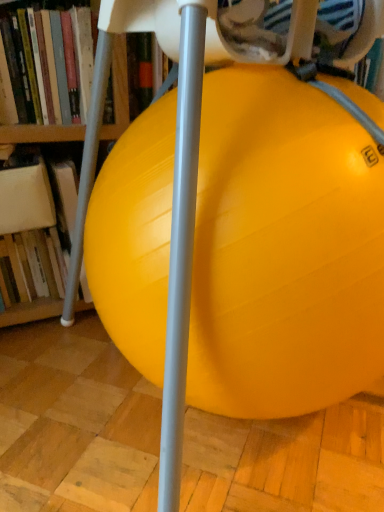
Describe the element at coordinates (26, 71) in the screenshot. I see `hardcover book at left, which is the first book from top to bottom` at that location.

I want to click on hardcover book at left, positioned as the 2th book in top-to-bottom order, so click(x=28, y=226).

Looking at their sizes, would you say yellow rubber ball at center is wider or thinner than hardcover book at left, positioned as the 2th book in top-to-bottom order?

In the image, yellow rubber ball at center appears to be wider than hardcover book at left, positioned as the 2th book in top-to-bottom order.

In terms of height, does yellow rubber ball at center look taller or shorter compared to hardcover book at left, positioned as the 1th book in bottom-to-top order?

In the image, yellow rubber ball at center appears to be taller than hardcover book at left, positioned as the 1th book in bottom-to-top order.

From a real-world perspective, who is located higher, yellow rubber ball at center or hardcover book at left, positioned as the 1th book in bottom-to-top order?

In real-world perspective, yellow rubber ball at center is above.

From the image's perspective, is yellow rubber ball at center located above or below hardcover book at left, which is the first book from top to bottom?

From the image's perspective, yellow rubber ball at center appears below hardcover book at left, which is the first book from top to bottom.

Who is shorter, yellow rubber ball at center or hardcover book at left, which is the first book from top to bottom?

hardcover book at left, which is the first book from top to bottom.

Which object is positioned more to the right, yellow rubber ball at center or hardcover book at left, which ranks as the 2th book in bottom-to-top order?

yellow rubber ball at center.

Is hardcover book at left, positioned as the 2th book in top-to-bottom order, facing away from yellow rubber ball at center?

No.

Is hardcover book at left, positioned as the 1th book in bottom-to-top order, outside of yellow rubber ball at center?

That's correct, hardcover book at left, positioned as the 1th book in bottom-to-top order, is outside of yellow rubber ball at center.

Which of these two, hardcover book at left, positioned as the 2th book in top-to-bottom order, or yellow rubber ball at center, is wider?

yellow rubber ball at center.

Can you confirm if hardcover book at left, positioned as the 1th book in bottom-to-top order, is shorter than yellow rubber ball at center?

Yes, hardcover book at left, positioned as the 1th book in bottom-to-top order, is shorter than yellow rubber ball at center.

Is hardcover book at left, which ranks as the 2th book in bottom-to-top order, at the back of hardcover book at left, positioned as the 2th book in top-to-bottom order?

No, hardcover book at left, which ranks as the 2th book in bottom-to-top order, is not at the back of hardcover book at left, positioned as the 2th book in top-to-bottom order.

From the image's perspective, would you say hardcover book at left, positioned as the 2th book in top-to-bottom order, is positioned over hardcover book at left, which ranks as the 2th book in bottom-to-top order?

No, from the image's perspective, hardcover book at left, positioned as the 2th book in top-to-bottom order, is not above hardcover book at left, which ranks as the 2th book in bottom-to-top order.

In terms of width, does hardcover book at left, positioned as the 2th book in top-to-bottom order, look wider or thinner when compared to hardcover book at left, which is the first book from top to bottom?

hardcover book at left, positioned as the 2th book in top-to-bottom order, is wider than hardcover book at left, which is the first book from top to bottom.

Is hardcover book at left, which ranks as the 2th book in bottom-to-top order, positioned beyond the bounds of yellow rubber ball at center?

That's correct, hardcover book at left, which ranks as the 2th book in bottom-to-top order, is outside of yellow rubber ball at center.

Is the position of hardcover book at left, which ranks as the 2th book in bottom-to-top order, more distant than that of yellow rubber ball at center?

That is True.

From the image's perspective, is hardcover book at left, which ranks as the 2th book in bottom-to-top order, under yellow rubber ball at center?

No, from the image's perspective, hardcover book at left, which ranks as the 2th book in bottom-to-top order, is not beneath yellow rubber ball at center.

How distant is hardcover book at left, which is the first book from top to bottom, from yellow rubber ball at center?

hardcover book at left, which is the first book from top to bottom, and yellow rubber ball at center are 16.39 inches apart.

Looking at the image, does hardcover book at left, which is the first book from top to bottom, seem bigger or smaller compared to hardcover book at left, positioned as the 2th book in top-to-bottom order?

In the image, hardcover book at left, which is the first book from top to bottom, appears to be smaller than hardcover book at left, positioned as the 2th book in top-to-bottom order.

Between hardcover book at left, which ranks as the 2th book in bottom-to-top order, and hardcover book at left, positioned as the 2th book in top-to-bottom order, which one is positioned behind?

hardcover book at left, positioned as the 2th book in top-to-bottom order.

From the image's perspective, between hardcover book at left, which ranks as the 2th book in bottom-to-top order, and hardcover book at left, positioned as the 2th book in top-to-bottom order, which one is located above?

hardcover book at left, which ranks as the 2th book in bottom-to-top order, is shown above in the image.

Considering the relative sizes of hardcover book at left, which is the first book from top to bottom, and hardcover book at left, positioned as the 1th book in bottom-to-top order, in the image provided, is hardcover book at left, which is the first book from top to bottom, shorter than hardcover book at left, positioned as the 1th book in bottom-to-top order,?

Yes, hardcover book at left, which is the first book from top to bottom, is shorter than hardcover book at left, positioned as the 1th book in bottom-to-top order.

Locate an element on the screen. This screenshot has height=512, width=384. the 2nd book counting from the left side of the yellow rubber ball at center is located at coordinates (28, 226).

Find the location of a particular element. ball directly beneath the hardcover book at left, which ranks as the 2th book in bottom-to-top order (from a real-world perspective) is located at coordinates [284, 250].

When comparing their distances from yellow rubber ball at center, does hardcover book at left, which is the first book from top to bottom, or hardcover book at left, positioned as the 1th book in bottom-to-top order, seem further?

Based on the image, hardcover book at left, positioned as the 1th book in bottom-to-top order, appears to be further to yellow rubber ball at center.

Based on their spatial positions, is hardcover book at left, which ranks as the 2th book in bottom-to-top order, or yellow rubber ball at center further from hardcover book at left, positioned as the 1th book in bottom-to-top order?

yellow rubber ball at center is further to hardcover book at left, positioned as the 1th book in bottom-to-top order.

When comparing their distances from hardcover book at left, which ranks as the 2th book in bottom-to-top order, does hardcover book at left, positioned as the 1th book in bottom-to-top order, or yellow rubber ball at center seem further?

yellow rubber ball at center.

From the image, which object appears to be nearer to hardcover book at left, which is the first book from top to bottom, yellow rubber ball at center or hardcover book at left, positioned as the 2th book in top-to-bottom order?

Among the two, hardcover book at left, positioned as the 2th book in top-to-bottom order, is located nearer to hardcover book at left, which is the first book from top to bottom.

Looking at this image, which object lies further to the anchor point yellow rubber ball at center, hardcover book at left, positioned as the 2th book in top-to-bottom order, or hardcover book at left, which ranks as the 2th book in bottom-to-top order?

The object further to yellow rubber ball at center is hardcover book at left, positioned as the 2th book in top-to-bottom order.

Estimate the real-world distances between objects in this image. Which object is closer to hardcover book at left, positioned as the 1th book in bottom-to-top order, yellow rubber ball at center or hardcover book at left, which ranks as the 2th book in bottom-to-top order?

hardcover book at left, which ranks as the 2th book in bottom-to-top order, is closer to hardcover book at left, positioned as the 1th book in bottom-to-top order.

You are a GUI agent. You are given a task and a screenshot of the screen. Output one action in this format:
    pyautogui.click(x=<x>, y=<y>)
    Task: Click on the book located between yellow rubber ball at center and hardcover book at left, positioned as the 2th book in top-to-bottom order, in the depth direction
    This screenshot has width=384, height=512.
    Given the screenshot: What is the action you would take?
    pyautogui.click(x=26, y=71)